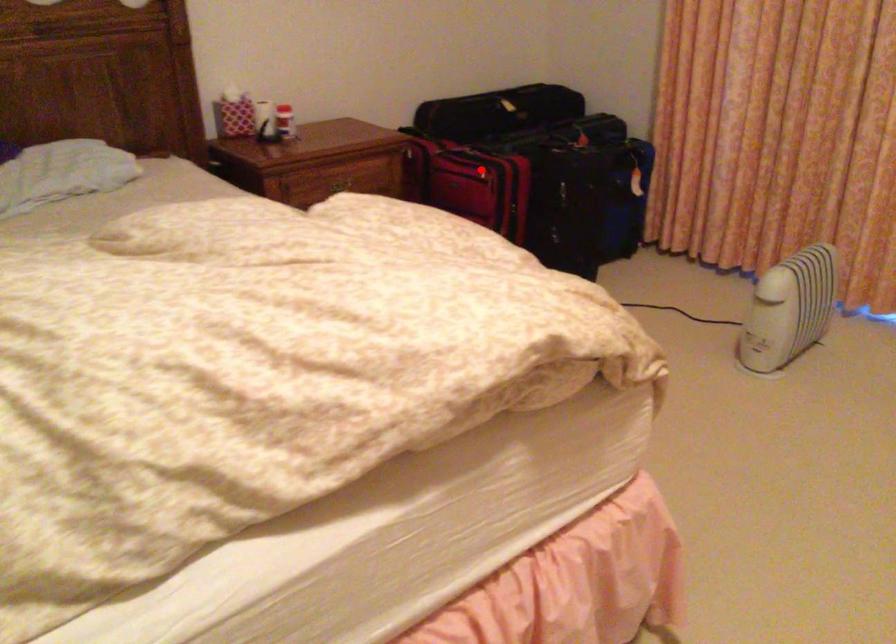
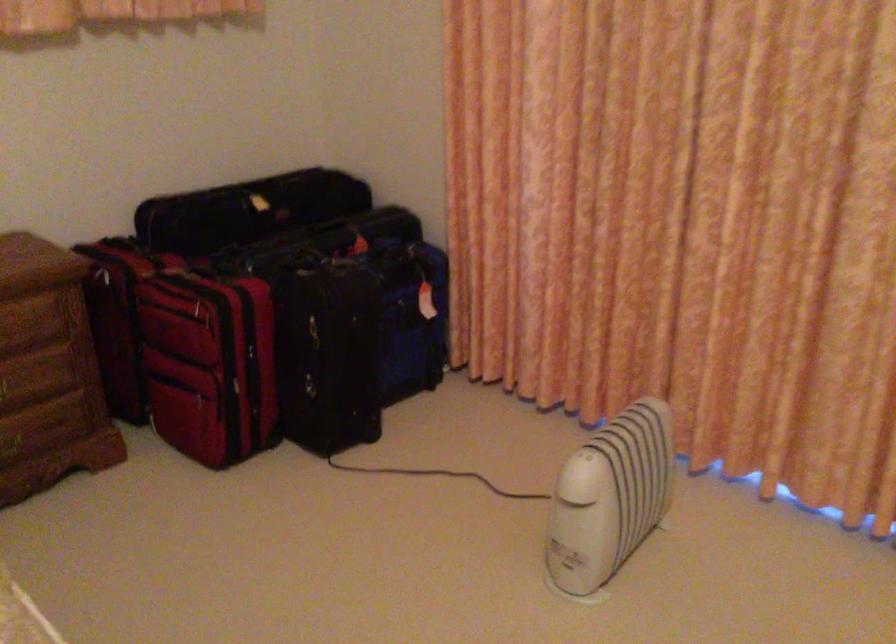
Question: I am providing you with two images of the same scene from different viewpoints. A red point is shown in image1. For the corresponding object point in image2, is it positioned nearer or farther from the camera?

Choices:
 (A) Nearer
 (B) Farther

Answer: (A)